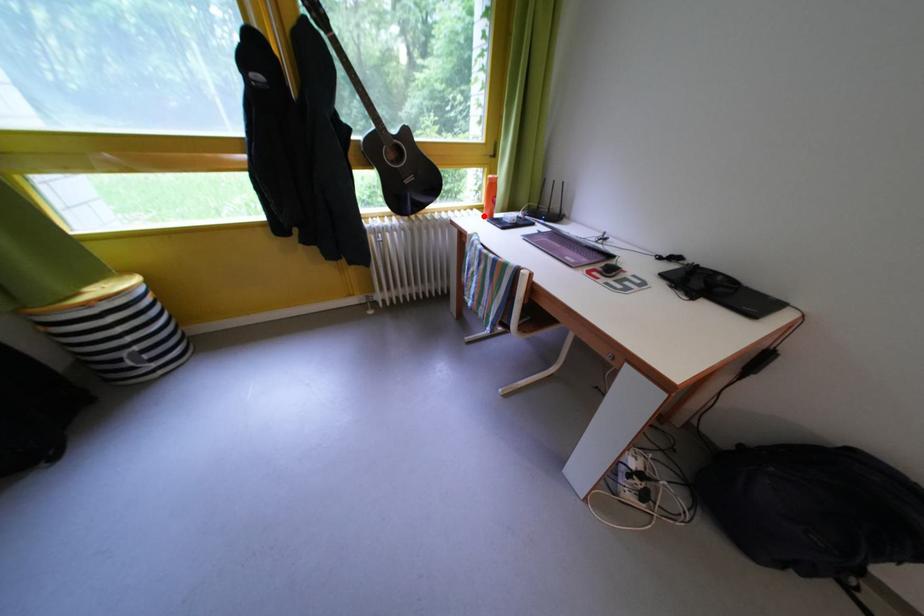
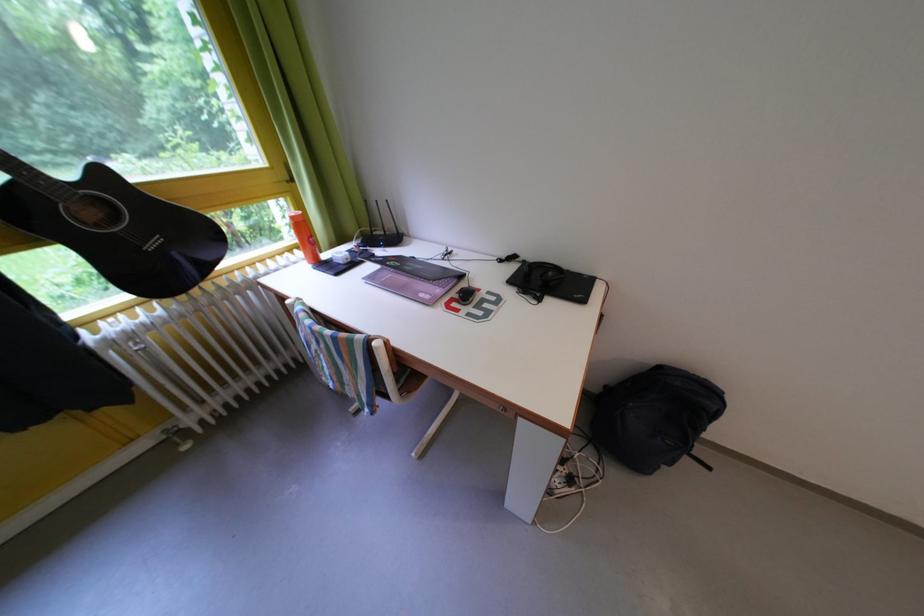
Find the pixel in the second image that matches the highlighted location in the first image.

(305, 257)